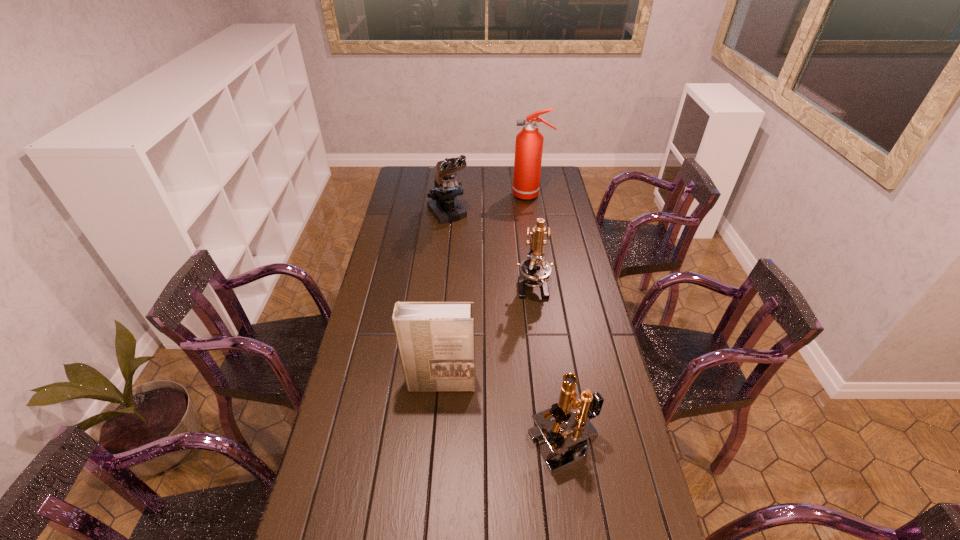
The image size is (960, 540). Find the location of `free space located on the cover of the phonebook`. free space located on the cover of the phonebook is located at coordinates (433, 480).

Where is `vacant region located 0.060m at the eyepiece of the nearest object`? vacant region located 0.060m at the eyepiece of the nearest object is located at coordinates (508, 446).

At what (x,y) coordinates should I click in order to perform the action: click on vacant space positioned at the eyepiece of the nearest object. Please return your answer as a coordinate pair (x, y). Looking at the image, I should click on (416, 446).

Locate an element on the screen. vacant region located 0.170m at the eyepiece of the nearest object is located at coordinates [x=468, y=446].

What are the coordinates of `object that is positioned at the far edge` in the screenshot? It's located at 529,142.

Locate an element on the screen. fire extinguisher that is positioned at the right edge is located at coordinates point(529,142).

Locate an element on the screen. The image size is (960, 540). object that is at the far right corner is located at coordinates (529, 142).

I want to click on free space at the far edge of the desktop, so click(x=492, y=168).

Image resolution: width=960 pixels, height=540 pixels. Identify the location of vacant space at the left edge of the desktop. (373, 353).

Locate an element on the screen. This screenshot has height=540, width=960. vacant region at the right edge is located at coordinates (598, 342).